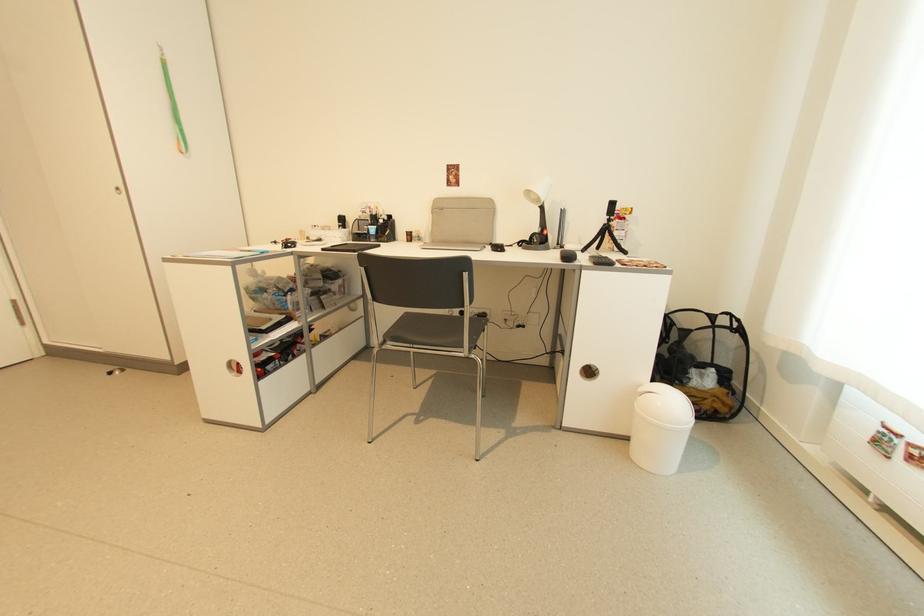
Find where to lift the white desk lamp. Please return your answer as a coordinate pair (x, y).

(538, 215)